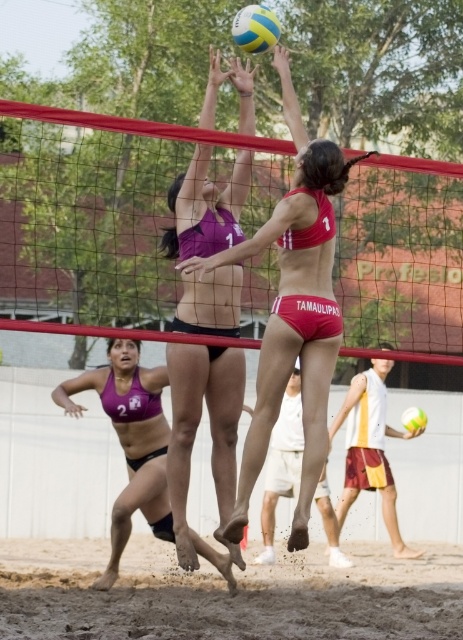
You are a photographer standing at the edge of the volleyball court. You want to take a photo that includes both the matte pink bikini at center and the purple matte bikini at lower left. The minimum distance between the two subjects for a clear shot is 2 meters. Can you capture them both in the same frame?

The matte pink bikini at center and the purple matte bikini at lower left are 2.19 meters apart, which exceeds the minimum required distance of 2 meters. Yes, you can capture both in the same frame.

You are a photographer positioned at the camera capturing this beach volleyball game. You notice two points in the frame at coordinates point (205, 134) and point (100, 554). Which of these two points is closer to your camera lens?

Point (205, 134) is closer to the camera lens than point (100, 554).